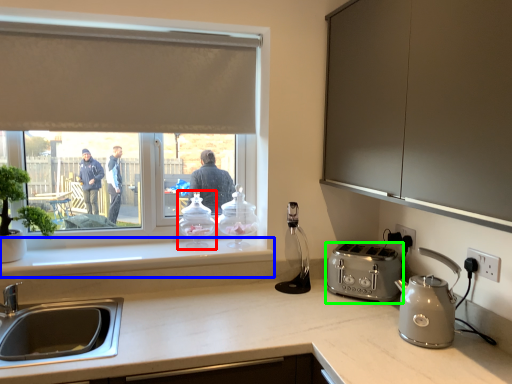
Question: Considering the real-world distances, which object is farthest from kitchen appliance (highlighted by a red box)? window sill (highlighted by a blue box) or toaster (highlighted by a green box)?

Choices:
 (A) window sill
 (B) toaster

Answer: (B)